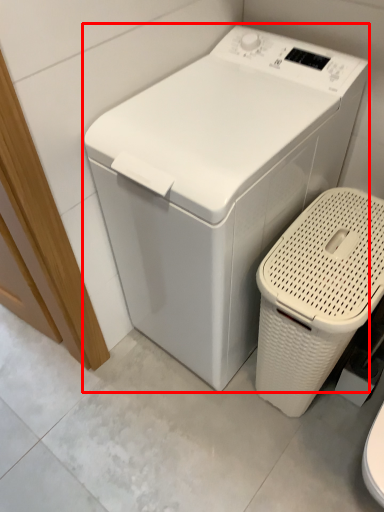
Question: From the image's perspective, what is the correct spatial relationship of washing machine (annotated by the red box) in relation to garbage?

Choices:
 (A) below
 (B) above

Answer: (B)